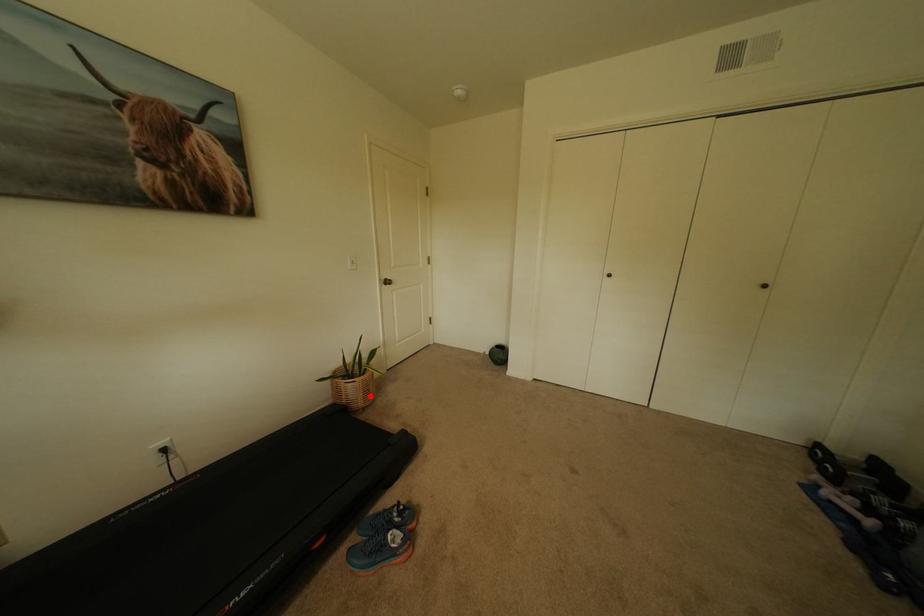
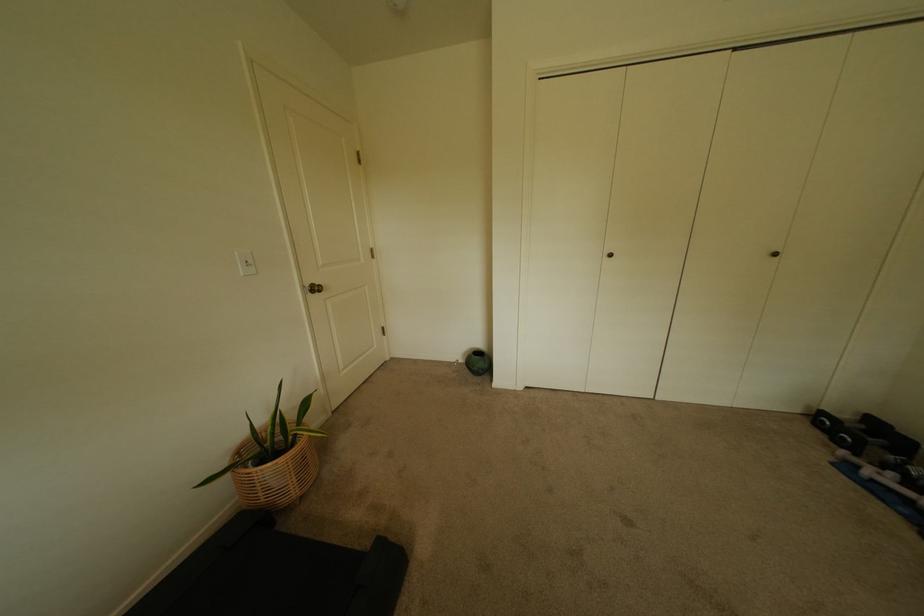
Where in the second image is the point corresponding to the highlighted location from the first image?

(302, 480)